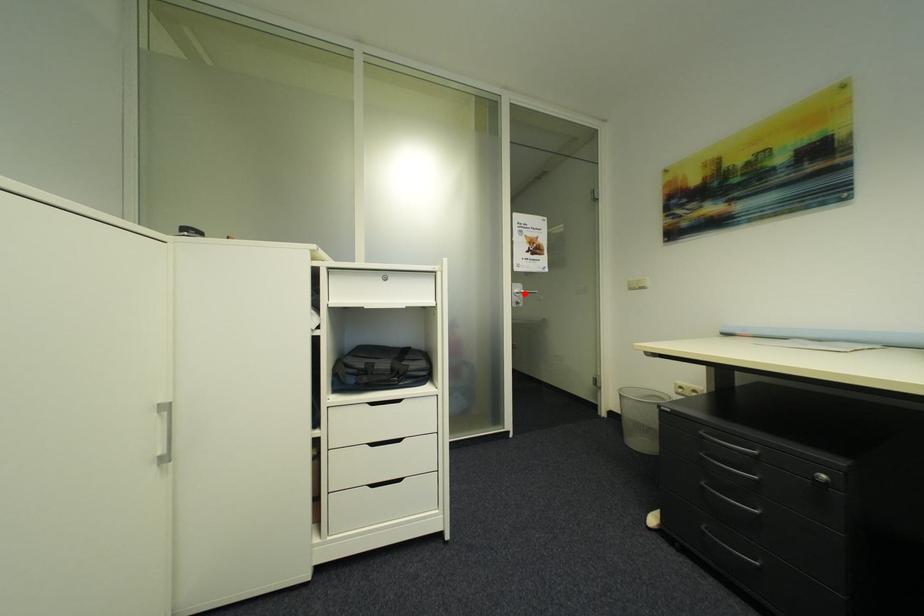
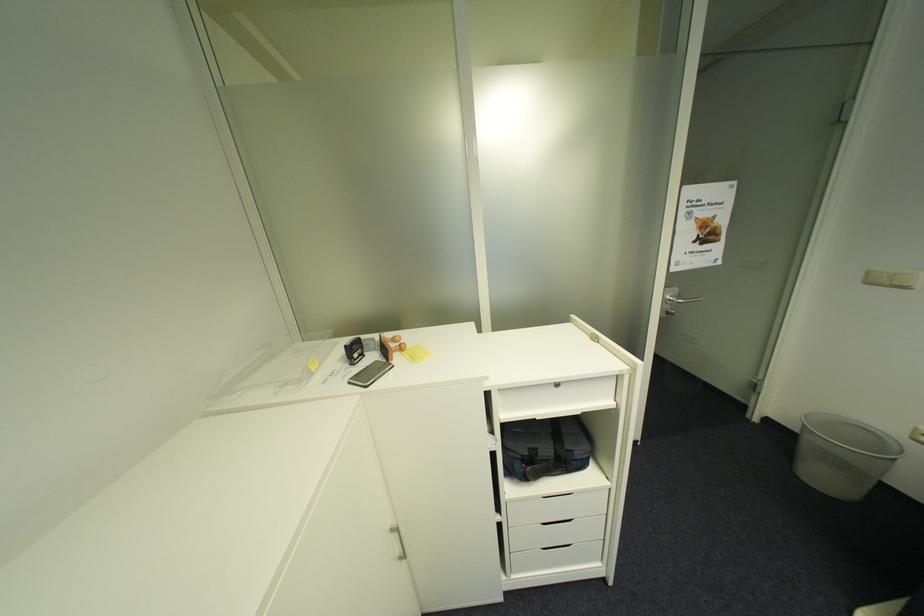
Where in the second image is the point corresponding to the highlighted location from the first image?

(676, 301)